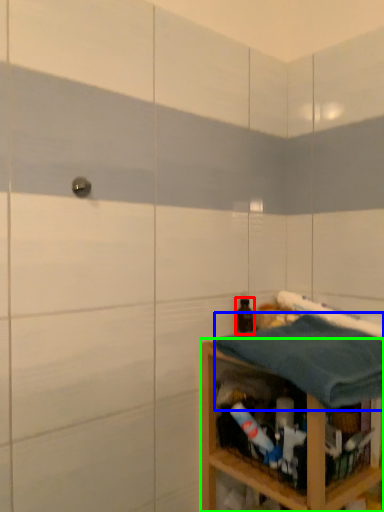
Question: Estimate the real-world distances between objects in this image. Which object is closer to bottle (highlighted by a red box), bath towel (highlighted by a blue box) or shelf (highlighted by a green box)?

Choices:
 (A) bath towel
 (B) shelf

Answer: (A)